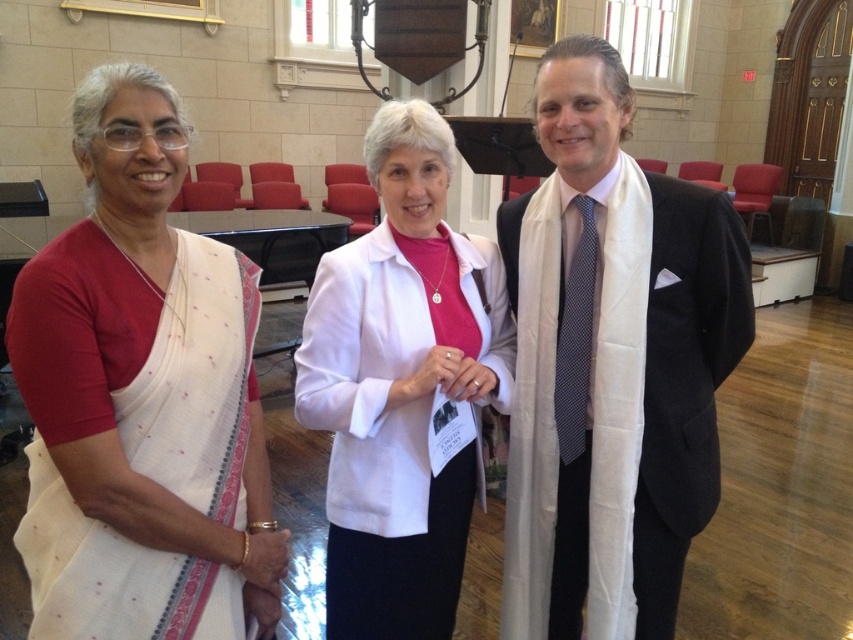
You are a photographer standing 1.5 meters away from the camera. You want to pick up the white silk scarf at center without moving the camera. Can you reach it while staying in place?

The white silk scarf at center and camera are 1.38 meters apart from each other. Since you are already 1.5 meters away from the camera, the total distance between you and the scarf is 1.5 meters plus 1.38 meters, which is 2.88 meters. You cannot reach the white silk scarf at center from that distance without moving.

Looking at this image, you are standing in the room and want to reach the point marked at coordinates (x=602, y=509). The red chairs are arranged in rows in front of you. Can you walk straight ahead to reach that point without moving around the chairs?

The point marked at coordinates (x=602, y=509) is 4.79 feet from the viewer. Since the red chairs are arranged in rows in front of you, you would need to navigate around them rather than walking straight ahead to reach the point.

You are taking a photo of the scene and want to focus on both point (689, 275) and point (564, 410). Which point should you focus on first to ensure both are in clear view?

You should focus on point (689, 275) first because it is closer to the camera than point (564, 410), ensuring both points will be in focus when focusing on the closer one first.